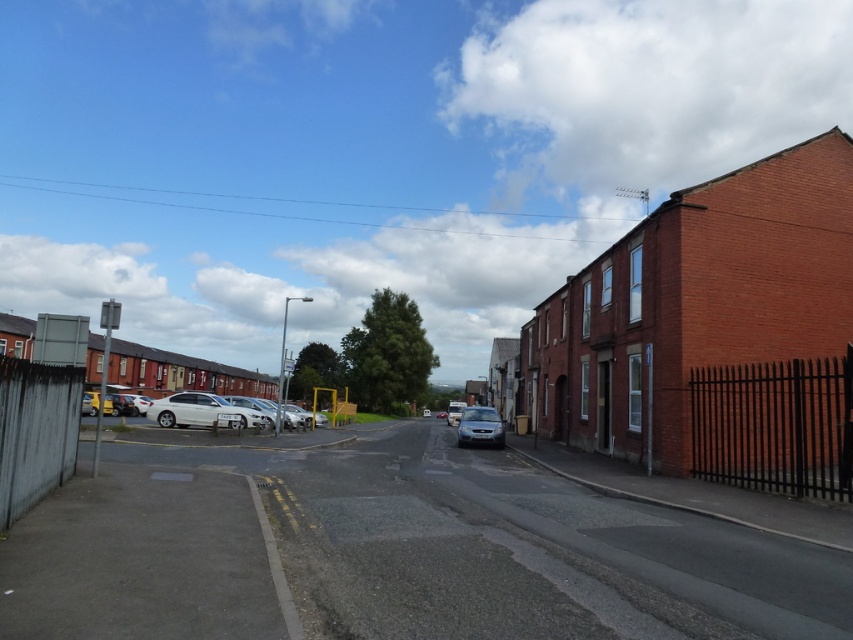
This screenshot has width=853, height=640. I want to click on white matte car at lower left, so click(207, 410).

Is white matte car at lower left taller than satin silver car at center?

Indeed, white matte car at lower left has a greater height compared to satin silver car at center.

The width and height of the screenshot is (853, 640). Identify the location of white matte car at lower left. (207, 410).

Measure the distance between white matte car at lower left and camera.

A distance of 27.57 meters exists between white matte car at lower left and camera.

Who is shorter, white matte car at lower left or silver metallic car at center?

Standing shorter between the two is white matte car at lower left.

Which is behind, point (212, 413) or point (445, 417)?

The point (445, 417) is more distant.

You are a GUI agent. You are given a task and a screenshot of the screen. Output one action in this format:
    pyautogui.click(x=<x>, y=<y>)
    Task: Click on the white matte car at lower left
    The height and width of the screenshot is (640, 853).
    Given the screenshot: What is the action you would take?
    pyautogui.click(x=207, y=410)

Is satin silver car at center further to the viewer compared to silver metallic car at center?

No, satin silver car at center is closer to the viewer.

Does satin silver car at center have a greater height compared to silver metallic car at center?

No, satin silver car at center is not taller than silver metallic car at center.

From the picture: Who is more distant from viewer, (480, 408) or (442, 410)?

The point (442, 410) is behind.

This screenshot has height=640, width=853. I want to click on satin silver car at center, so click(480, 426).